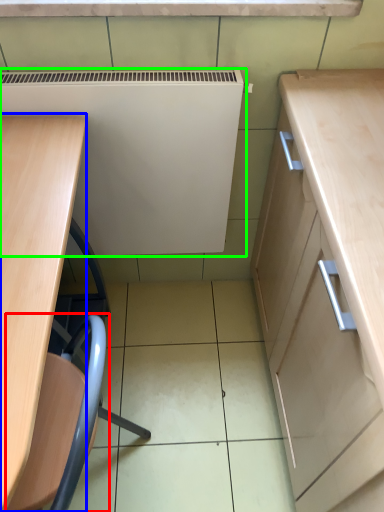
Question: Estimate the real-world distances between objects in this image. Which object is closer to swivel chair (highlighted by a red box), desk (highlighted by a blue box) or appliance (highlighted by a green box)?

Choices:
 (A) desk
 (B) appliance

Answer: (A)